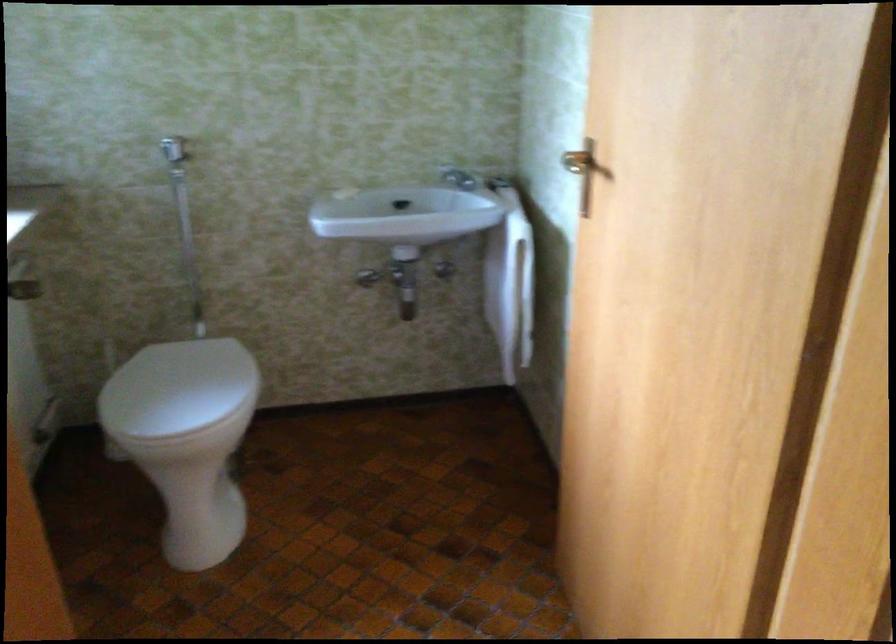
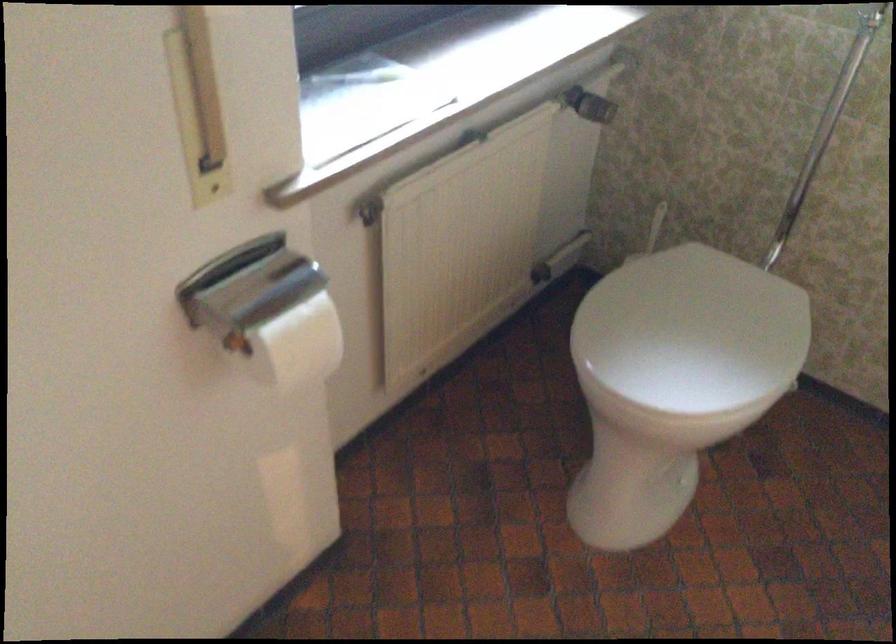
Locate, in the second image, the point that corresponds to point (192, 388) in the first image.

(692, 330)